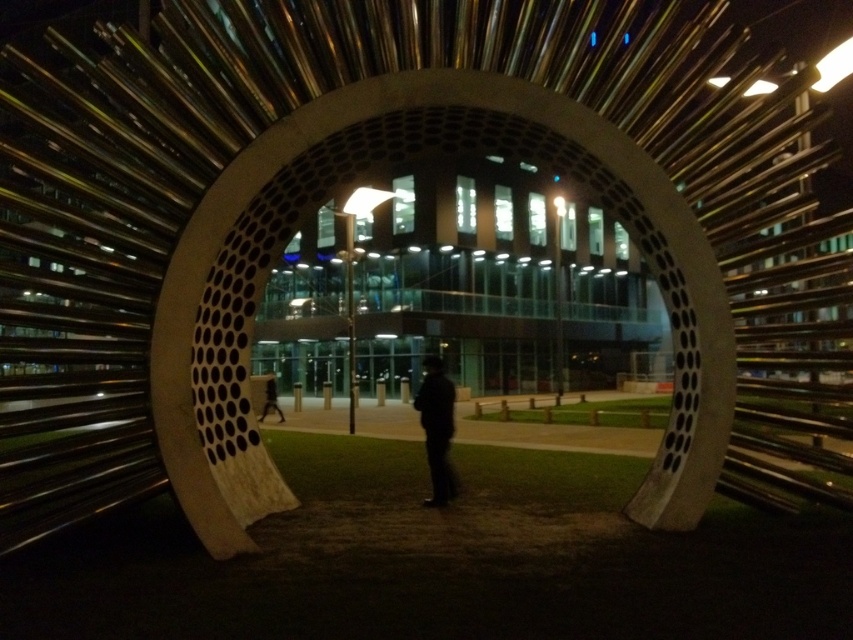
You are a photographer standing in front of the modern architectural structure. You notice a black matte jacket at center and a dark clothing figure at center. Which object is positioned to the right of the other?

The black matte jacket at center is to the right of the dark clothing figure at center.

You are a security guard in a parking lot. You notice a black matte jacket at center and a dark clothing figure at center. The parking lot has a rule that any two objects must be at least 10 meters apart for safety. Do these two items comply with the rule?

The black matte jacket at center and dark clothing figure at center are 10.25 meters apart from each other, which meets the minimum 10 meters requirement, so they comply with the safety rule.